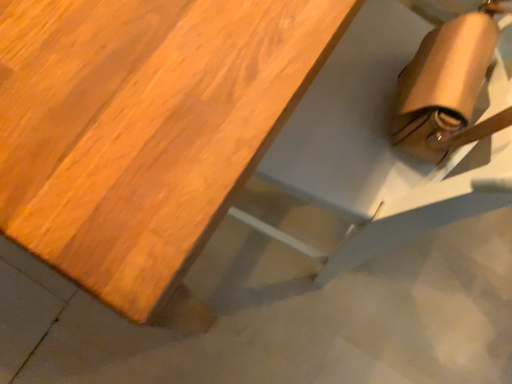
What do you see at coordinates (144, 127) in the screenshot?
I see `wooden table at upper left` at bounding box center [144, 127].

Identify the location of wooden table at upper left. (144, 127).

Image resolution: width=512 pixels, height=384 pixels. What do you see at coordinates (396, 132) in the screenshot?
I see `matte brown bag at lower right` at bounding box center [396, 132].

Where is `matte brown bag at lower right`? matte brown bag at lower right is located at coordinates (396, 132).

Identify the location of wooden table at upper left. The image size is (512, 384). (144, 127).

Considering the positions of objects wooden table at upper left and matte brown bag at lower right in the image provided, who is more to the left, wooden table at upper left or matte brown bag at lower right?

wooden table at upper left.

Between wooden table at upper left and matte brown bag at lower right, which one is positioned in front?

Positioned in front is wooden table at upper left.

Does point (67, 22) come farther from viewer compared to point (442, 172)?

No, (67, 22) is in front of (442, 172).

From the image's perspective, is wooden table at upper left above matte brown bag at lower right?

Yes, from the image's perspective, wooden table at upper left is above matte brown bag at lower right.

From a real-world perspective, is wooden table at upper left positioned under matte brown bag at lower right based on gravity?

Yes, from a real-world perspective, wooden table at upper left is under matte brown bag at lower right.

Between wooden table at upper left and matte brown bag at lower right, which one has smaller width?

matte brown bag at lower right is thinner.

Does wooden table at upper left have a lesser height compared to matte brown bag at lower right?

Correct, wooden table at upper left is not as tall as matte brown bag at lower right.

Considering the sizes of objects wooden table at upper left and matte brown bag at lower right in the image provided, who is bigger, wooden table at upper left or matte brown bag at lower right?

wooden table at upper left is bigger.

Is matte brown bag at lower right located within wooden table at upper left?

Yes, wooden table at upper left is surrounding matte brown bag at lower right.

Is wooden table at upper left not close to matte brown bag at lower right?

No, wooden table at upper left is not far from matte brown bag at lower right.

Is wooden table at upper left looking in the opposite direction of matte brown bag at lower right?

That's right, wooden table at upper left is facing away from matte brown bag at lower right.

What's the angular difference between wooden table at upper left and matte brown bag at lower right's facing directions?

They differ by 1.08 degrees in their facing directions.

How far apart are wooden table at upper left and matte brown bag at lower right?

The distance of wooden table at upper left from matte brown bag at lower right is 12.81 inches.

Identify the location of table in front of the matte brown bag at lower right. Image resolution: width=512 pixels, height=384 pixels. (144, 127).

Does matte brown bag at lower right appear on the right side of wooden table at upper left?

Indeed, matte brown bag at lower right is positioned on the right side of wooden table at upper left.

Is matte brown bag at lower right positioned in front of wooden table at upper left?

No.

Considering the positions of point (389, 46) and point (301, 24), is point (389, 46) closer or farther from the camera than point (301, 24)?

Point (389, 46) appears to be farther away from the viewer than point (301, 24).

From the image's perspective, is matte brown bag at lower right below wooden table at upper left?

Yes, from the image's perspective, matte brown bag at lower right is beneath wooden table at upper left.

From a real-world perspective, between matte brown bag at lower right and wooden table at upper left, who is vertically lower?

wooden table at upper left is physically lower.

Considering the sizes of matte brown bag at lower right and wooden table at upper left in the image, is matte brown bag at lower right wider or thinner than wooden table at upper left?

Clearly, matte brown bag at lower right has less width compared to wooden table at upper left.

In terms of height, does matte brown bag at lower right look taller or shorter compared to wooden table at upper left?

Considering their sizes, matte brown bag at lower right has more height than wooden table at upper left.

Looking at the image, does matte brown bag at lower right seem bigger or smaller compared to wooden table at upper left?

Considering their sizes, matte brown bag at lower right takes up less space than wooden table at upper left.

Which is correct: matte brown bag at lower right is inside wooden table at upper left, or outside of it?

matte brown bag at lower right exists entirely within wooden table at upper left.

Does matte brown bag at lower right touch wooden table at upper left?

There is a gap between matte brown bag at lower right and wooden table at upper left.

Could you tell me if matte brown bag at lower right is turned towards wooden table at upper left?

Yes, matte brown bag at lower right is facing wooden table at upper left.

Can you tell me how much matte brown bag at lower right and wooden table at upper left differ in facing direction?

The angle between the facing direction of matte brown bag at lower right and the facing direction of wooden table at upper left is 1.08 degrees.

The width and height of the screenshot is (512, 384). I want to click on chair above the wooden table at upper left (from a real-world perspective), so click(396, 132).

Image resolution: width=512 pixels, height=384 pixels. I want to click on chair below the wooden table at upper left (from the image's perspective), so click(x=396, y=132).

The image size is (512, 384). I want to click on table below the matte brown bag at lower right (from a real-world perspective), so click(144, 127).